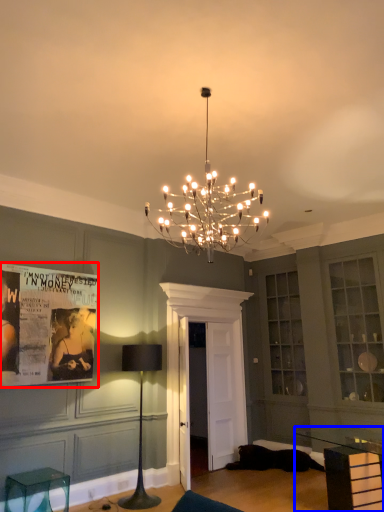
Question: Which object appears closest to the camera in this image, poster page (highlighted by a red box) or table (highlighted by a blue box)?

Choices:
 (A) poster page
 (B) table

Answer: (B)